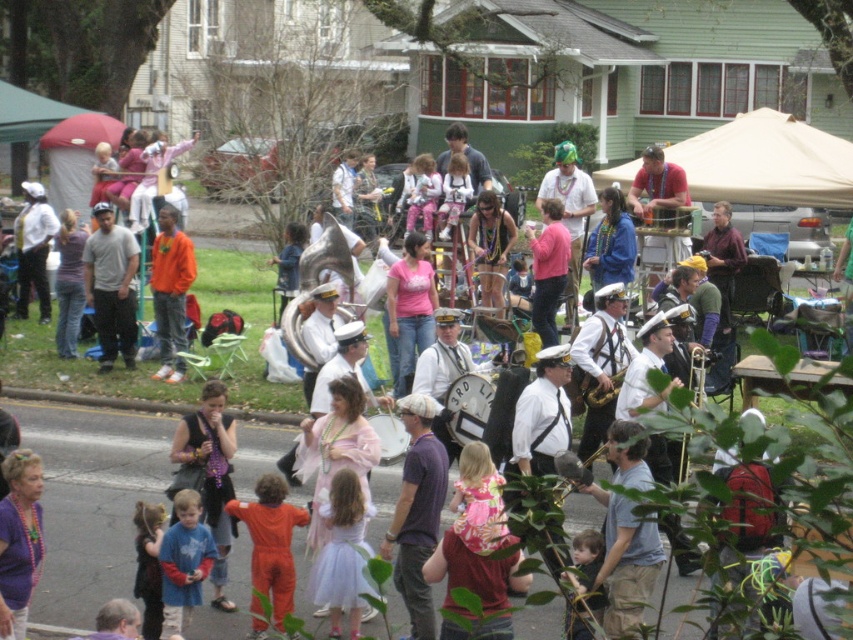
Which is below, beige fabric canopy at center or light blue tulle dress at center?

light blue tulle dress at center is below.

Identify the location of beige fabric canopy at center. (766, 163).

Can you confirm if orange jumpsuit at center is positioned to the right of gold brass trumpet at center?

In fact, orange jumpsuit at center is to the left of gold brass trumpet at center.

Which is below, orange jumpsuit at center or gold brass trumpet at center?

orange jumpsuit at center

At what (x,y) coordinates should I click in order to perform the action: click on orange jumpsuit at center. Please return your answer as a coordinate pair (x, y). Looking at the image, I should click on (271, 541).

Locate an element on the screen. orange jumpsuit at center is located at coordinates (271, 541).

Between orange jumpsuit at center and orange matte shirt at center, which one has less height?

Standing shorter between the two is orange jumpsuit at center.

Does point (238, 512) come in front of point (163, 209)?

Yes, it is in front of point (163, 209).

Is point (279, 480) positioned after point (152, 269)?

That is False.

The width and height of the screenshot is (853, 640). I want to click on orange jumpsuit at center, so click(x=271, y=541).